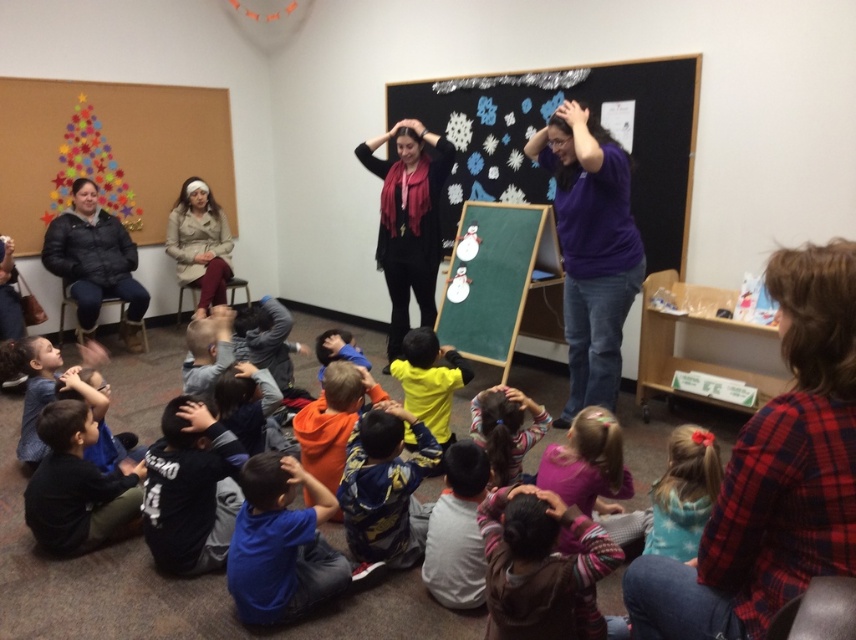
You are a student sitting on the floor in the classroom scene. You need to write something on the matte black chalkboard at center but you can only reach up to the level of the striped sweater at center. Can you reach the chalkboard?

The matte black chalkboard at center is above the striped sweater at center, so you cannot reach it since the chalkboard is higher than your maximum reach level.

You are a photographer positioned at the back of the room. You want to take a photo of the dark brown hair at center and the purple cotton shirt at center. Which one is blocking the view of the other?

The purple cotton shirt at center is blocking the view of the dark brown hair at center because the dark brown hair at center is behind the purple cotton shirt at center.